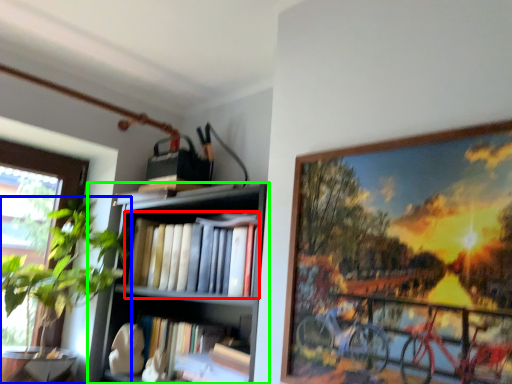
Question: Considering the real-world distances, which object is farthest from book (highlighted by a red box)? houseplant (highlighted by a blue box) or shelf (highlighted by a green box)?

Choices:
 (A) houseplant
 (B) shelf

Answer: (A)